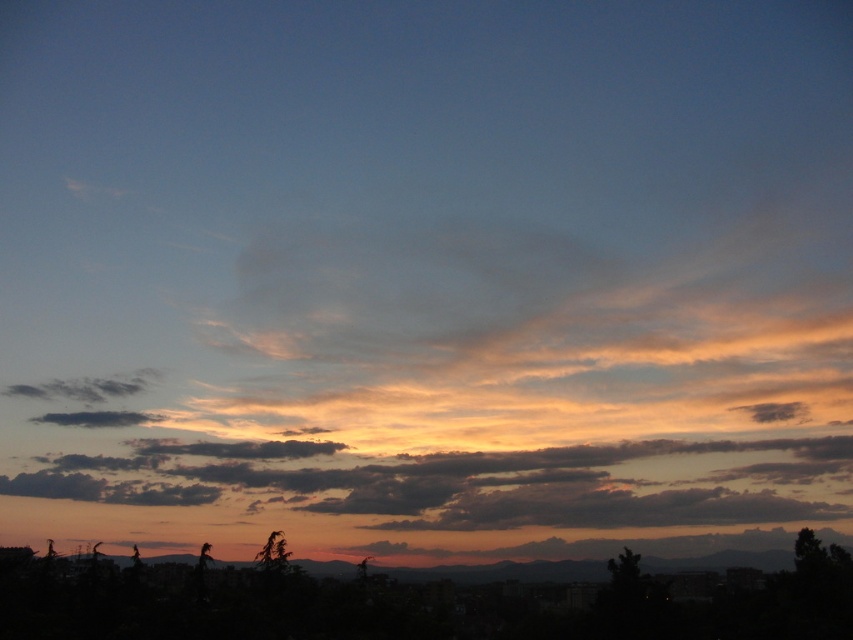
Question: Among these points, which one is farthest from the camera?

Choices:
 (A) (57, 474)
 (B) (485, 244)

Answer: (A)

Question: Which of the following is the closest to the observer?

Choices:
 (A) cloudy orange sky at center
 (B) translucent orange cloud at upper center

Answer: (A)

Question: Does translucent orange cloud at upper center appear on the left side of cloudy orange sky at center?

Choices:
 (A) no
 (B) yes

Answer: (A)

Question: Which point is farther to the camera?

Choices:
 (A) translucent orange cloud at upper center
 (B) cloudy orange sky at center

Answer: (A)

Question: Can you confirm if translucent orange cloud at upper center is positioned above cloudy orange sky at center?

Choices:
 (A) yes
 (B) no

Answer: (A)

Question: In this image, where is translucent orange cloud at upper center located relative to cloudy orange sky at center?

Choices:
 (A) left
 (B) right

Answer: (B)